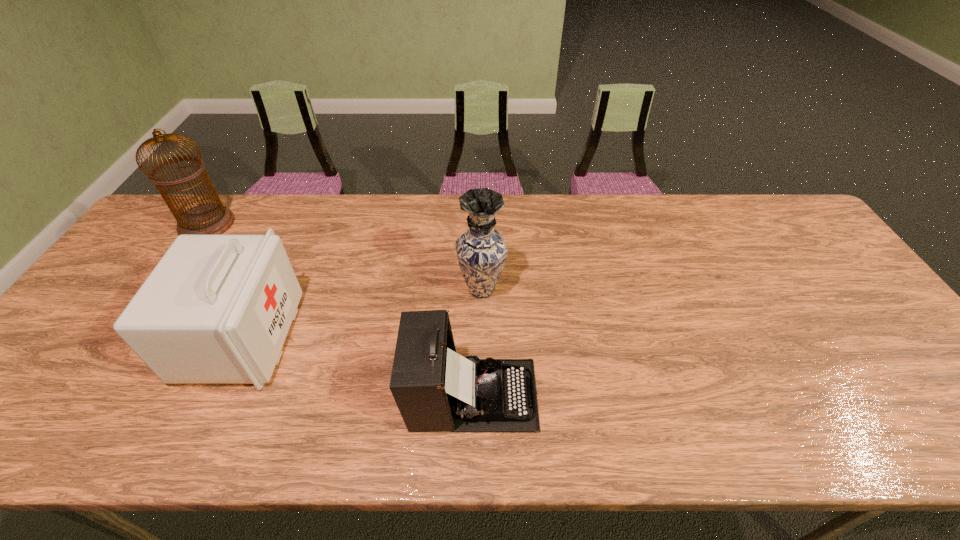
Locate an element on the screen. This screenshot has width=960, height=540. birdcage is located at coordinates (211, 218).

Locate an element on the screen. the farthest object is located at coordinates (211, 218).

Locate an element on the screen. vase is located at coordinates (481, 251).

Find the location of a particular element. This screenshot has height=540, width=960. the second object from left to right is located at coordinates (216, 309).

Find the location of `typewriter`. typewriter is located at coordinates (436, 389).

Locate an element on the screen. free space located on the front-facing side of the farthest object is located at coordinates (254, 224).

Locate an element on the screen. This screenshot has width=960, height=540. free spot located on the back of the vase is located at coordinates (481, 230).

Identify the location of free space located 0.400m on the front-facing side of the second object from left to right. This screenshot has height=540, width=960. (449, 337).

I want to click on free location located inside the open case of the shortest object, so click(652, 395).

Locate an element on the screen. This screenshot has width=960, height=540. object positioned at the far edge is located at coordinates [211, 218].